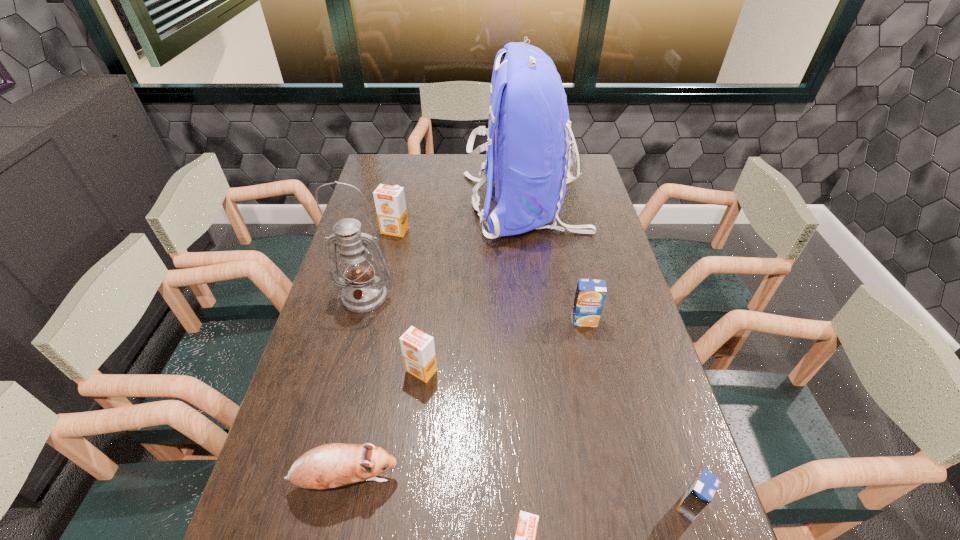
Locate an element on the screen. blue backpack is located at coordinates (528, 158).

Where is `backpack`? This screenshot has width=960, height=540. backpack is located at coordinates (528, 158).

You are a GUI agent. You are given a task and a screenshot of the screen. Output one action in this format:
    pyautogui.click(x=<x>, y=<y>)
    Task: Click on the second tallest object
    The width and height of the screenshot is (960, 540).
    Given the screenshot: What is the action you would take?
    pyautogui.click(x=362, y=291)

You are a GUI agent. You are given a task and a screenshot of the screen. Output one action in this format:
    pyautogui.click(x=<x>, y=<y>)
    Task: Click on the oil lamp
    The image size is (960, 540).
    Given the screenshot: What is the action you would take?
    click(x=362, y=291)

Find the location of a particular element. The image size is (960, 540). the leftmost orange orange juice is located at coordinates (390, 203).

You are a GUI agent. You are given a task and a screenshot of the screen. Output one action in this format:
    pyautogui.click(x=<x>, y=<y>)
    Task: Click on the biggest orange orange juice
    This screenshot has width=960, height=540.
    Given the screenshot: What is the action you would take?
    pyautogui.click(x=390, y=203)

You are a GUI agent. You are given a task and a screenshot of the screen. Output one action in this format:
    pyautogui.click(x=<x>, y=<y>)
    Task: Click on the second orange juice from right to left
    This screenshot has width=960, height=540.
    Given the screenshot: What is the action you would take?
    pyautogui.click(x=590, y=295)

Locate an element on the screen. This screenshot has height=540, width=960. the bigger blue orange_juice is located at coordinates (590, 295).

Where is `the fifth farthest object`? The width and height of the screenshot is (960, 540). the fifth farthest object is located at coordinates (418, 349).

Locate an element on the screen. Image resolution: width=960 pixels, height=540 pixels. the second orange orange juice from right to left is located at coordinates (418, 349).